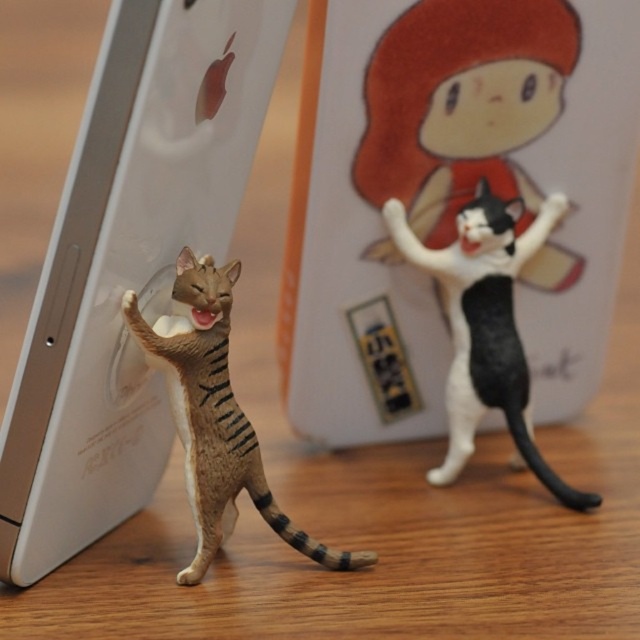
Can you confirm if matte white phone at left is bigger than brown striped cat at center?

Yes.

Which is behind, point (141, 147) or point (250, 477)?

The point (250, 477) is more distant.

This screenshot has height=640, width=640. In order to click on matte white phone at left in this screenshot , I will do `click(128, 262)`.

Can you confirm if black and white plastic cat at right is smaller than brown striped cat at center?

Correct, black and white plastic cat at right occupies less space than brown striped cat at center.

In order to click on black and white plastic cat at right in this screenshot , I will do `click(486, 324)`.

Based on the photo, between matte white phone at left and black and white plastic cat at right, which one has less height?

black and white plastic cat at right

Does matte white phone at left appear under black and white plastic cat at right?

No.

What do you see at coordinates (128, 262) in the screenshot? I see `matte white phone at left` at bounding box center [128, 262].

You are a GUI agent. You are given a task and a screenshot of the screen. Output one action in this format:
    pyautogui.click(x=<x>, y=<y>)
    Task: Click on the matte white phone at left
    Image resolution: width=640 pixels, height=640 pixels.
    Given the screenshot: What is the action you would take?
    pyautogui.click(x=128, y=262)